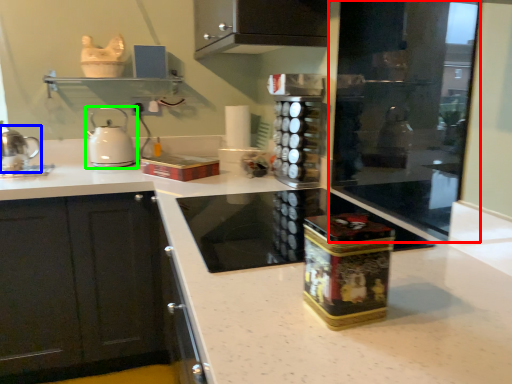
Question: Which object is the farthest from screen door (highlighted by a red box)? Choose among these: kitchen appliance (highlighted by a blue box) or kitchen appliance (highlighted by a green box).

Choices:
 (A) kitchen appliance
 (B) kitchen appliance

Answer: (A)